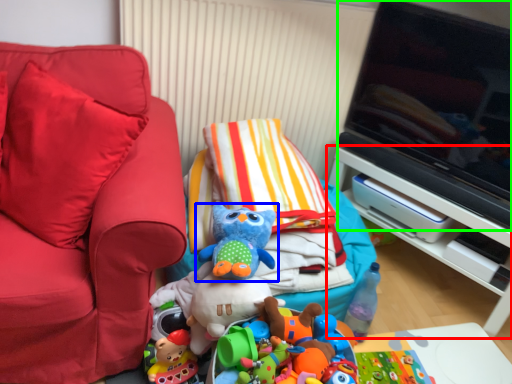
Question: Which is nearer to the furniture (highlighted by a red box)? toy (highlighted by a blue box) or television (highlighted by a green box).

Choices:
 (A) toy
 (B) television

Answer: (B)